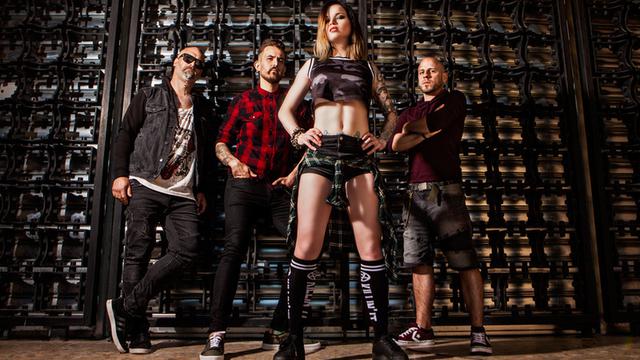
The height and width of the screenshot is (360, 640). I want to click on wall, so click(562, 148), click(65, 235).